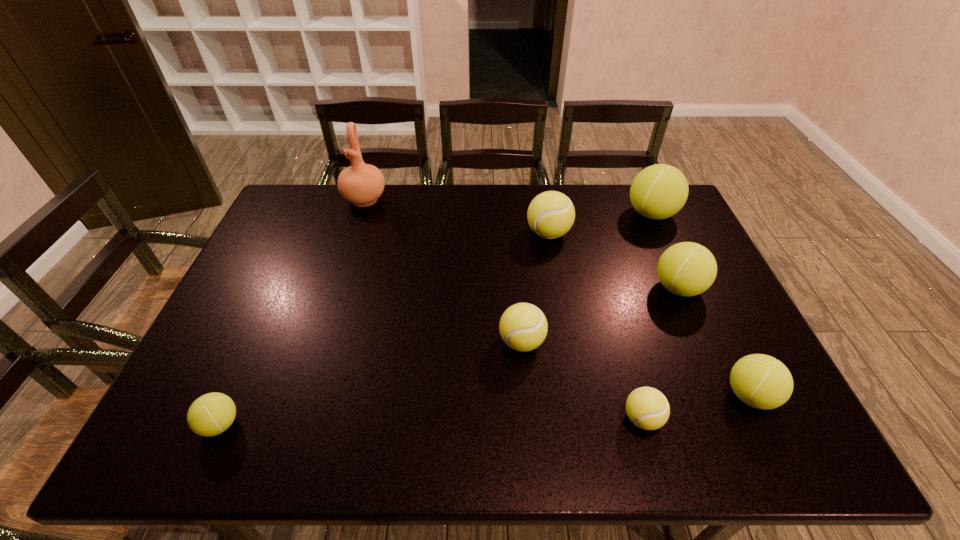
Where is `free space that satisfies the following two spatial constraints: 1. on the front side of the tallest tennis ball; 2. on the right side of the second smallest green tennis ball`? This screenshot has width=960, height=540. free space that satisfies the following two spatial constraints: 1. on the front side of the tallest tennis ball; 2. on the right side of the second smallest green tennis ball is located at coordinates (733, 395).

This screenshot has width=960, height=540. Find the location of `vacant area in the image that satisfies the following two spatial constraints: 1. on the back side of the second smallest green tennis ball; 2. on the right side of the rightmost yellow tennis ball`. vacant area in the image that satisfies the following two spatial constraints: 1. on the back side of the second smallest green tennis ball; 2. on the right side of the rightmost yellow tennis ball is located at coordinates (636, 395).

Locate an element on the screen. The width and height of the screenshot is (960, 540). blank space that satisfies the following two spatial constraints: 1. on the spout of the third smallest green tennis ball; 2. on the right side of the pottery is located at coordinates (337, 288).

Image resolution: width=960 pixels, height=540 pixels. In order to click on free space that satisfies the following two spatial constraints: 1. on the spout of the second farthest yellow tennis ball; 2. on the left side of the tallest object in this screenshot , I will do `click(320, 342)`.

Identify the location of vacant space that satisfies the following two spatial constraints: 1. on the back side of the smallest yellow tennis ball; 2. on the left side of the third biggest green tennis ball. [636, 395].

Find the location of a particular element. Image resolution: width=960 pixels, height=540 pixels. free spot that satisfies the following two spatial constraints: 1. on the spout of the seventh shortest object; 2. on the right side of the tallest object is located at coordinates (360, 214).